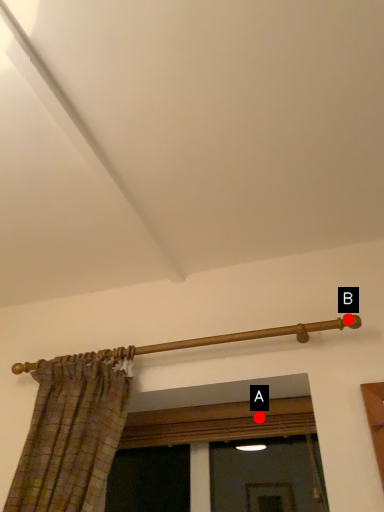
Question: Two points are circled on the image, labeled by A and B beside each circle. Which of the following is the farthest from the observer?

Choices:
 (A) A is further
 (B) B is further

Answer: (A)